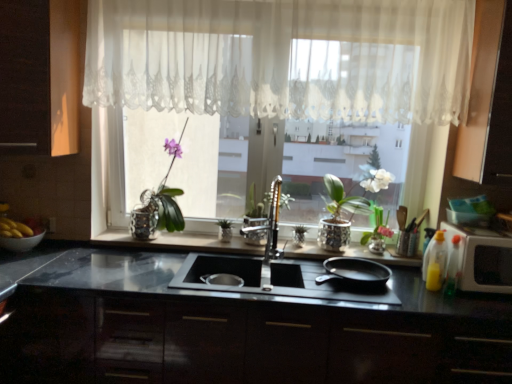
The image size is (512, 384). Identify the location of vacant space in front of transparent glass bowl at right, which ranks as the second glass bowl in left-to-right order. (483, 232).